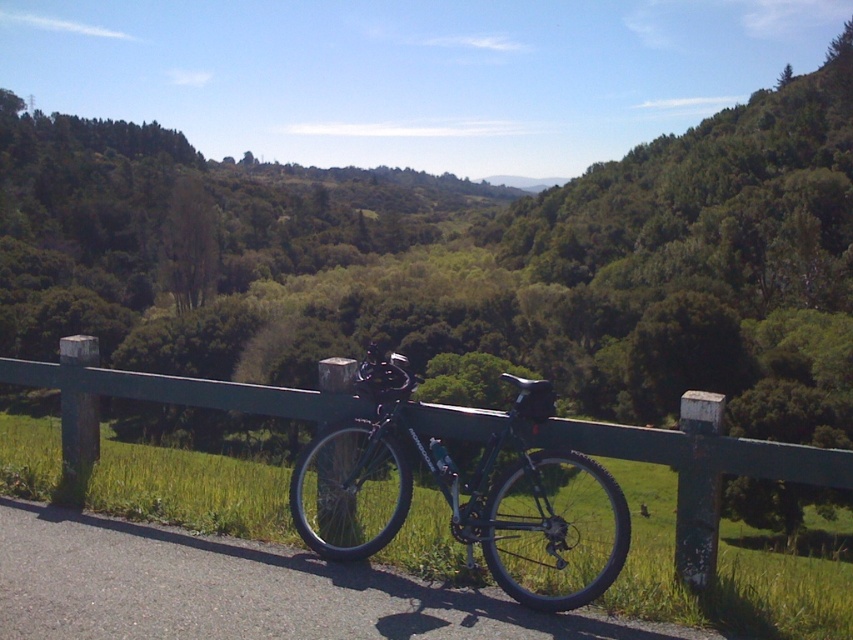
Between green metal fence at center and matte black bicycle at center, which one appears on the left side from the viewer's perspective?

From the viewer's perspective, green metal fence at center appears more on the left side.

Between green metal fence at center and matte black bicycle at center, which one is positioned lower?

matte black bicycle at center is lower down.

Which is behind, point (585, 433) or point (523, 388)?

Point (585, 433)

Identify the location of green metal fence at center. (700, 467).